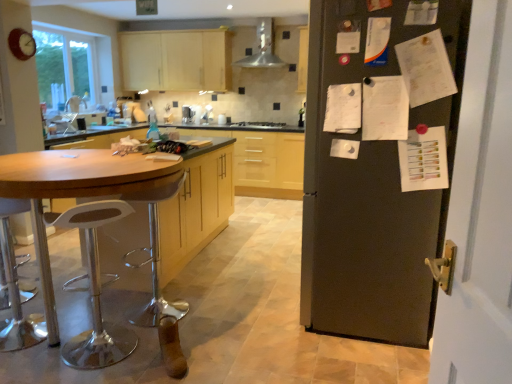
Question: Is metallic silver range hood at upper center thinner than matte wood cabinets at upper center, which is the 2th cabinetry in bottom-to-top order?

Choices:
 (A) yes
 (B) no

Answer: (B)

Question: Is matte wood cabinets at upper center, which is the 2th cabinetry in bottom-to-top order, located within metallic silver range hood at upper center?

Choices:
 (A) yes
 (B) no

Answer: (B)

Question: Would you say metallic silver range hood at upper center is outside matte wood cabinets at upper center, which is the 2th cabinetry in bottom-to-top order?

Choices:
 (A) yes
 (B) no

Answer: (A)

Question: Is metallic silver range hood at upper center taller than matte wood cabinets at upper center, which is the 2th cabinetry in bottom-to-top order?

Choices:
 (A) yes
 (B) no

Answer: (B)

Question: Is metallic silver range hood at upper center further to the viewer compared to matte wood cabinets at upper center, which is the 2th cabinetry in bottom-to-top order?

Choices:
 (A) yes
 (B) no

Answer: (B)

Question: From the image's perspective, is metallic silver range hood at upper center above matte wood cabinets at upper center, which ranks as the first cabinetry in top-to-bottom order?

Choices:
 (A) no
 (B) yes

Answer: (B)

Question: Considering the relative sizes of yellow wood cabinets at center, which is the 2th cabinetry from top to bottom, and matte wood cabinets at upper center, which is the 2th cabinetry in bottom-to-top order, in the image provided, is yellow wood cabinets at center, which is the 2th cabinetry from top to bottom, taller than matte wood cabinets at upper center, which is the 2th cabinetry in bottom-to-top order,?

Choices:
 (A) no
 (B) yes

Answer: (B)

Question: Can you confirm if yellow wood cabinets at center, which is the 2th cabinetry from top to bottom, is thinner than matte wood cabinets at upper center, which ranks as the first cabinetry in top-to-bottom order?

Choices:
 (A) no
 (B) yes

Answer: (A)

Question: Is yellow wood cabinets at center, which is the 2th cabinetry from top to bottom, next to matte wood cabinets at upper center, which ranks as the first cabinetry in top-to-bottom order?

Choices:
 (A) yes
 (B) no

Answer: (B)

Question: Could you tell me if yellow wood cabinets at center, the 1th cabinetry positioned from the bottom, is turned towards matte wood cabinets at upper center, which ranks as the first cabinetry in top-to-bottom order?

Choices:
 (A) yes
 (B) no

Answer: (B)

Question: From a real-world perspective, is yellow wood cabinets at center, the 1th cabinetry positioned from the bottom, beneath matte wood cabinets at upper center, which ranks as the first cabinetry in top-to-bottom order?

Choices:
 (A) no
 (B) yes

Answer: (B)

Question: Can you confirm if yellow wood cabinets at center, the 1th cabinetry positioned from the bottom, is wider than matte wood cabinets at upper center, which ranks as the first cabinetry in top-to-bottom order?

Choices:
 (A) yes
 (B) no

Answer: (A)

Question: From the image's perspective, does wooden table at left appear higher than satin silver stove at center?

Choices:
 (A) no
 (B) yes

Answer: (A)